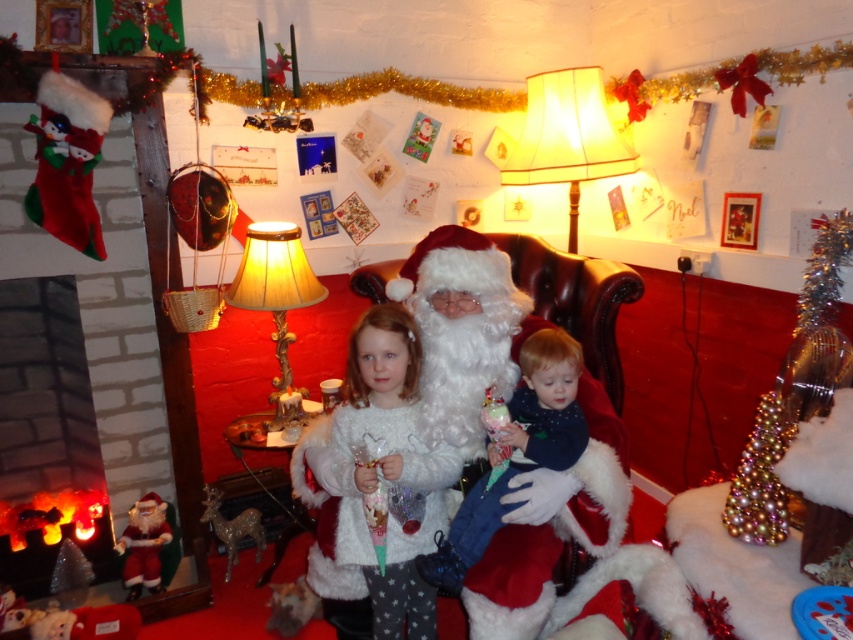
Question: Does white fluffy sweater at center have a lesser width compared to shiny metallic tinsel at right?

Choices:
 (A) yes
 (B) no

Answer: (A)

Question: Which point is farther to the camera?

Choices:
 (A) (462, 324)
 (B) (787, 397)
 (C) (474, 532)

Answer: (B)

Question: Which object is positioned closest to the brick fireplace at left?

Choices:
 (A) fluffy white blanket at center
 (B) white fluffy sweater at center
 (C) white fluffy santa at center
 (D) shiny metallic tinsel at right

Answer: (B)

Question: Is white fluffy santa at center positioned at the back of fluffy white blanket at center?

Choices:
 (A) yes
 (B) no

Answer: (A)

Question: Which point is closer to the camera taking this photo?

Choices:
 (A) (543, 352)
 (B) (817, 292)
 (C) (488, 385)

Answer: (A)

Question: Can you confirm if white fluffy sweater at center is thinner than white fluffy santa at center?

Choices:
 (A) yes
 (B) no

Answer: (B)